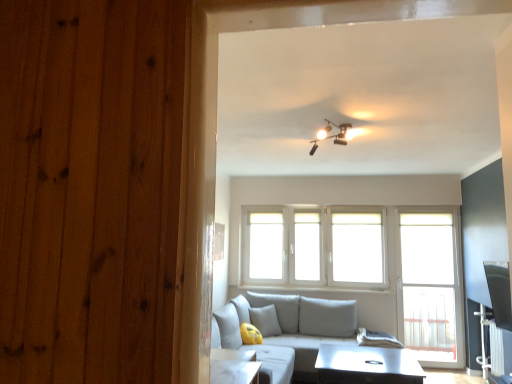
Question: Considering the relative sizes of white glossy table at center and white fabric curtain at lower right in the image provided, is white glossy table at center smaller than white fabric curtain at lower right?

Choices:
 (A) no
 (B) yes

Answer: (A)

Question: Considering the relative positions of white glossy table at center and white fabric curtain at lower right in the image provided, is white glossy table at center behind white fabric curtain at lower right?

Choices:
 (A) no
 (B) yes

Answer: (A)

Question: Is there a large distance between white glossy table at center and white fabric curtain at lower right?

Choices:
 (A) yes
 (B) no

Answer: (A)

Question: Is white glossy table at center not within white fabric curtain at lower right?

Choices:
 (A) yes
 (B) no

Answer: (A)

Question: From a real-world perspective, is white glossy table at center beneath white fabric curtain at lower right?

Choices:
 (A) no
 (B) yes

Answer: (B)

Question: Is white fabric curtain at lower right completely or partially inside white glossy table at center?

Choices:
 (A) yes
 (B) no

Answer: (B)

Question: Is white glossy table at center shorter than yellow fabric pillow at lower center?

Choices:
 (A) no
 (B) yes

Answer: (B)

Question: From the image's perspective, is white glossy table at center located beneath yellow fabric pillow at lower center?

Choices:
 (A) no
 (B) yes

Answer: (B)

Question: Is white glossy table at center behind yellow fabric pillow at lower center?

Choices:
 (A) yes
 (B) no

Answer: (B)

Question: Does white glossy table at center appear on the right side of yellow fabric pillow at lower center?

Choices:
 (A) yes
 (B) no

Answer: (A)

Question: Considering the relative positions of white glossy table at center and yellow fabric pillow at lower center in the image provided, is white glossy table at center to the left of yellow fabric pillow at lower center from the viewer's perspective?

Choices:
 (A) yes
 (B) no

Answer: (B)

Question: Is white glossy table at center oriented away from yellow fabric pillow at lower center?

Choices:
 (A) no
 (B) yes

Answer: (A)

Question: Does light gray fabric couch at center have a greater width compared to white fabric curtain at lower right?

Choices:
 (A) yes
 (B) no

Answer: (A)